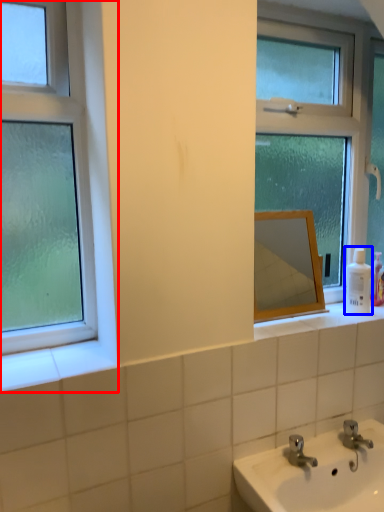
Question: Which object is further to the camera taking this photo, window (highlighted by a red box) or toiletry (highlighted by a blue box)?

Choices:
 (A) window
 (B) toiletry

Answer: (B)